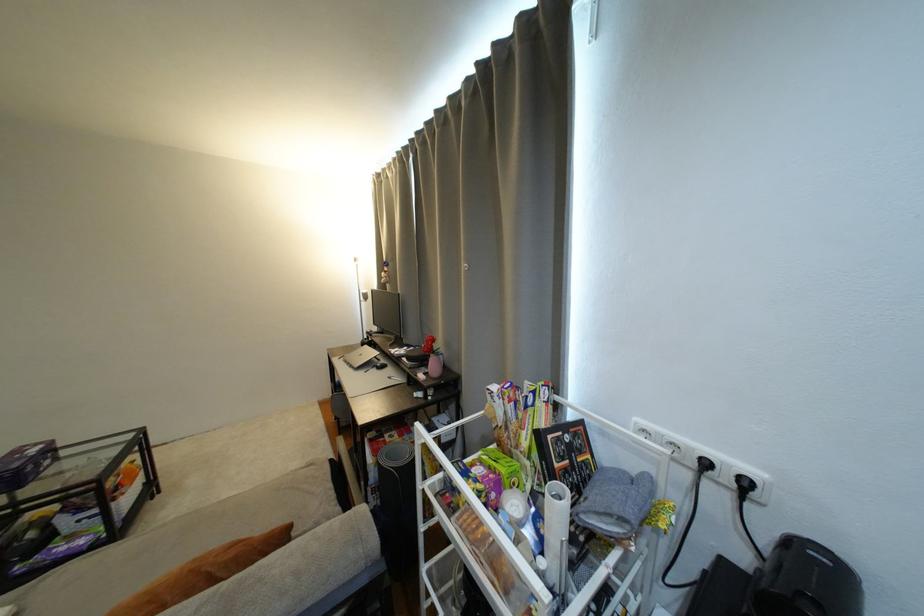
Find where to lift the rolled yoga mat. Please return your answer as a coordinate pair (x, y).

(294, 572)